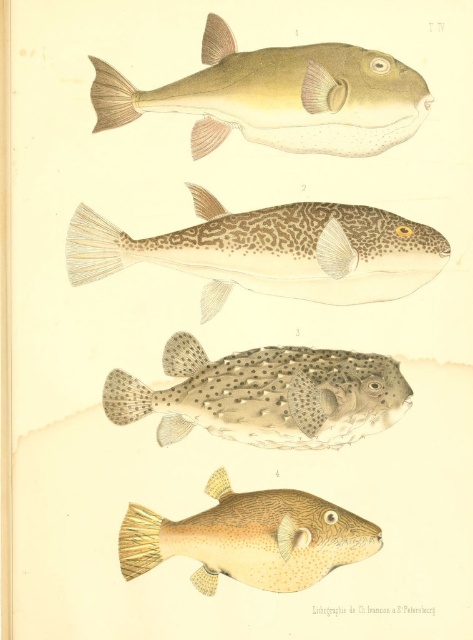
Is matte green fish at upper center positioned behind brown textured fish at bottom right?

Yes, matte green fish at upper center is further from the viewer.

Is point (224, 92) behind point (198, 554)?

Yes, it is.

Is point (167, 84) more distant than point (329, 531)?

Yes, point (167, 84) is behind point (329, 531).

Locate an element on the screen. The height and width of the screenshot is (640, 473). matte green fish at upper center is located at coordinates [x=279, y=97].

Measure the distance between point (151, 404) and camera.

Point (151, 404) is 4.10 feet away from camera.

Between point (367, 429) and point (312, 568), which one is positioned in front?

Point (312, 568) is in front.

Is point (121, 404) farther from viewer compared to point (239, 568)?

Yes, it is behind point (239, 568).

Locate an element on the screen. spotted brown skin at center is located at coordinates (264, 396).

Can you confirm if speckled leather pufferfish at center is smaller than brown textured fish at bottom right?

No, speckled leather pufferfish at center is not smaller than brown textured fish at bottom right.

The width and height of the screenshot is (473, 640). What are the coordinates of `speckled leather pufferfish at center` in the screenshot? It's located at (271, 252).

I want to click on speckled leather pufferfish at center, so click(271, 252).